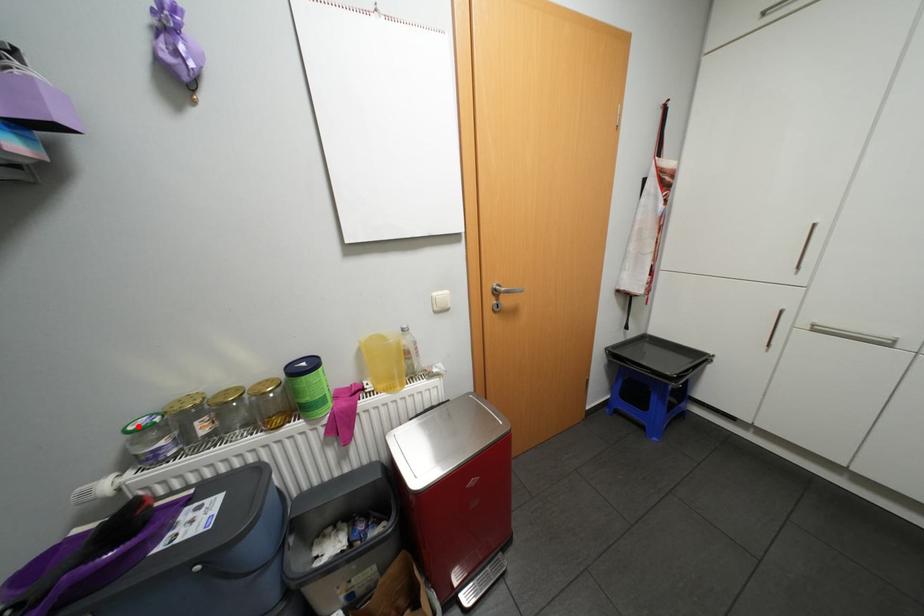
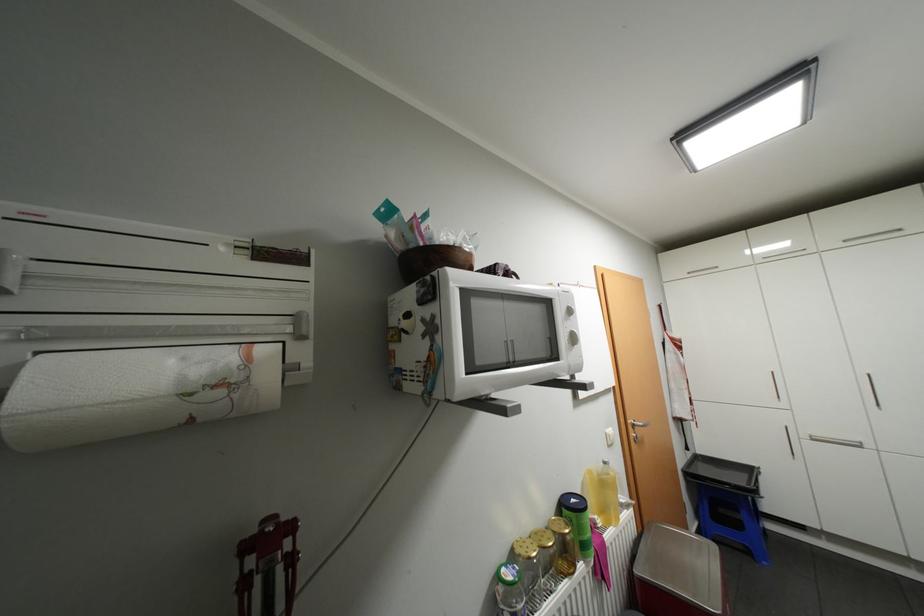
In the second image, find the point that corresponds to the highlighted location in the first image.

(518, 576)